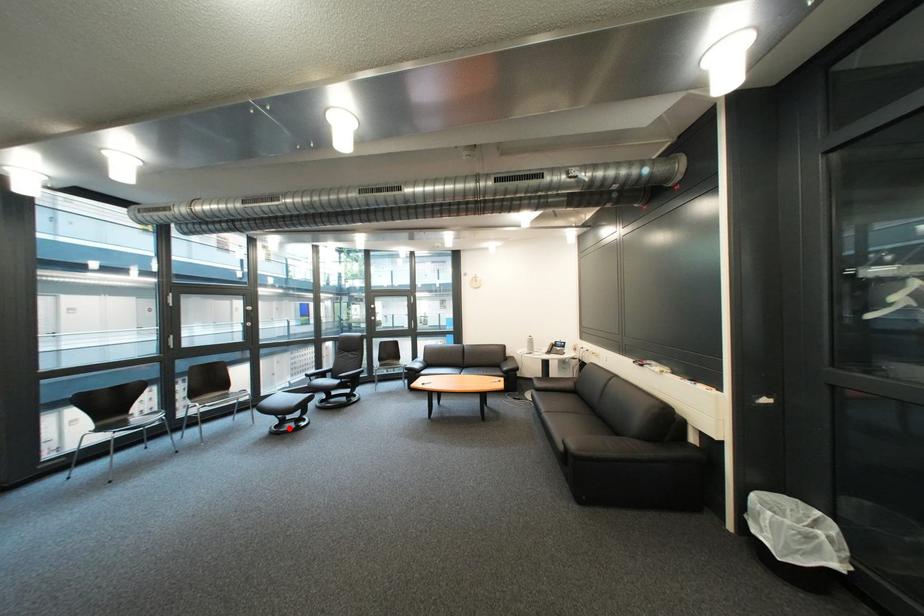
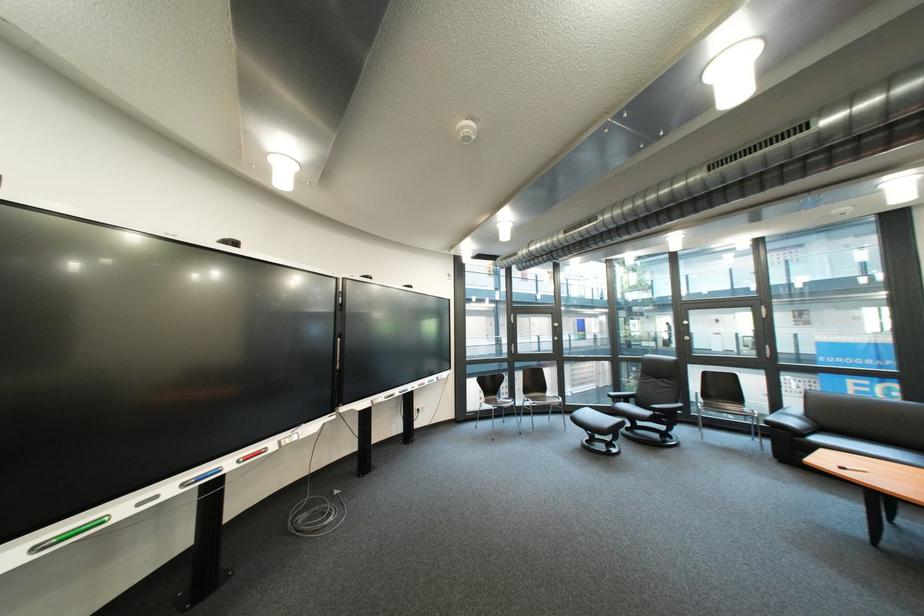
In the second image, find the point that corresponds to the highlighted location in the first image.

(601, 443)